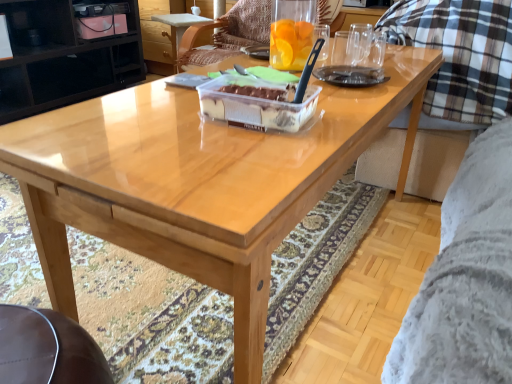
Locate an element on the screen. This screenshot has width=512, height=384. space that is in front of translucent plastic cake at center is located at coordinates (247, 153).